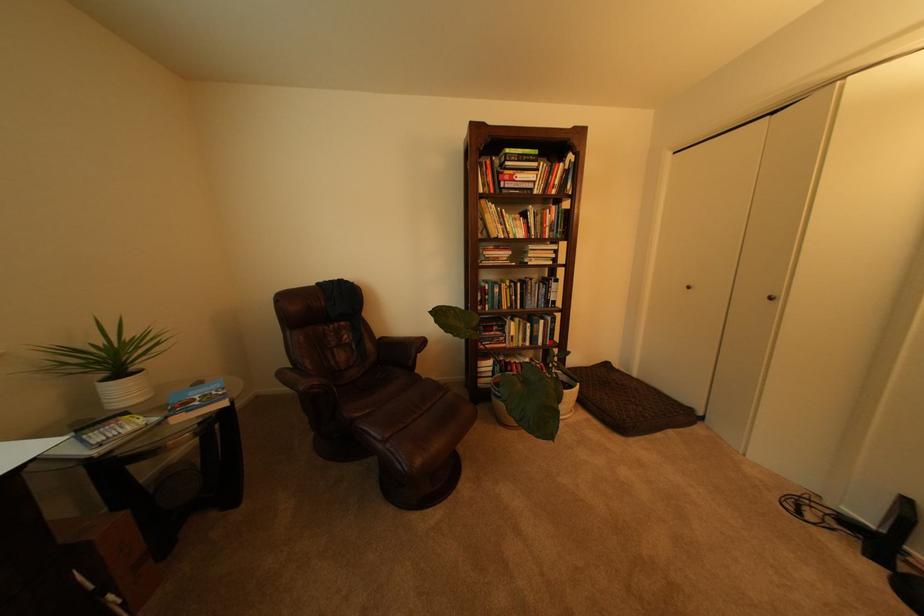
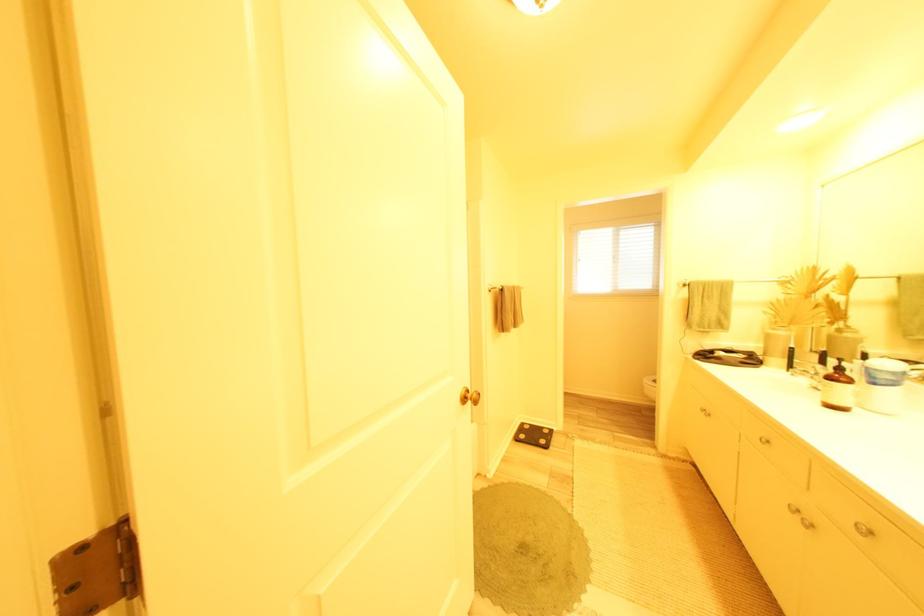
Question: I am providing you with two images of the same scene from different viewpoints. Please identify which objects are invisible in image2.

Choices:
 (A) blue jar lid
 (B) silver door knob
 (C) keyed switch
 (D) brown bottle pump

Answer: (B)